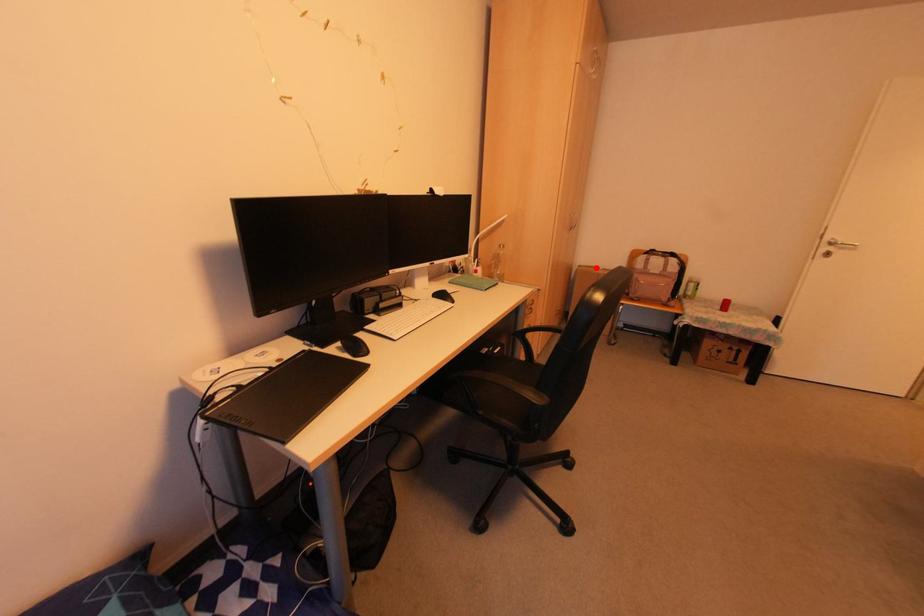
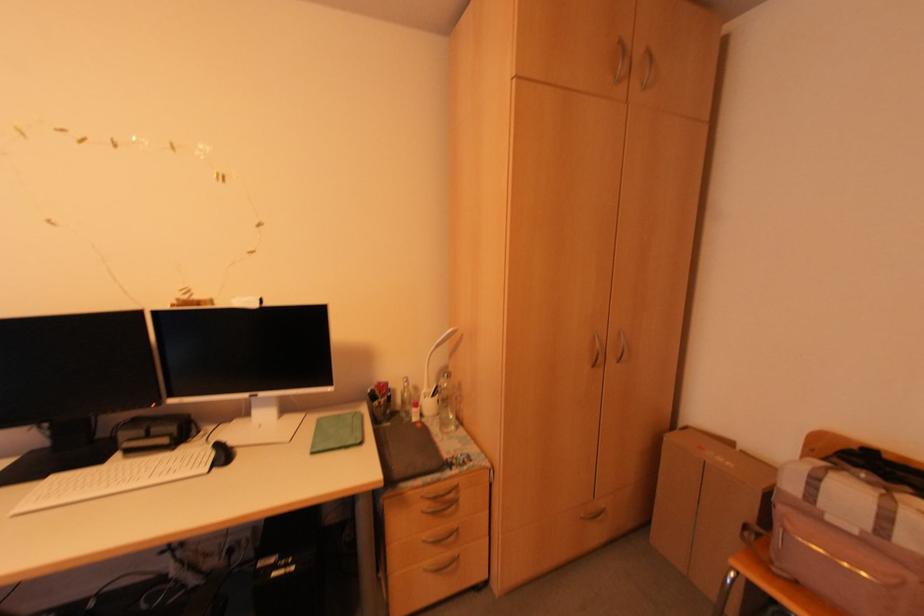
Question: I am providing you with two images of the same scene from different viewpoints. Given a red point in image1, look at the same physical point in image2. Is it:

Choices:
 (A) Closer to the viewpoint
 (B) Farther from the viewpoint

Answer: (B)